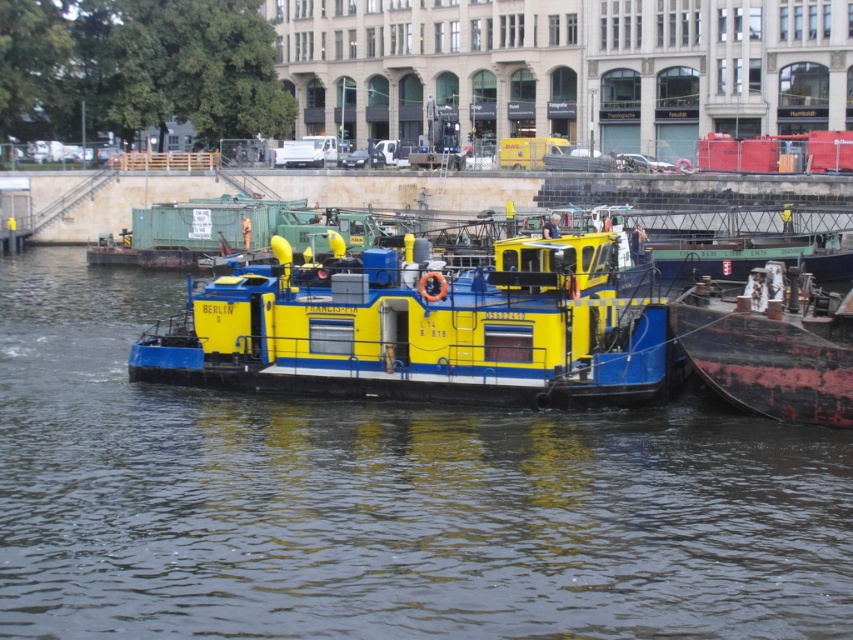
You are a crane operator standing on a platform 2 meters above the water level. You need to lower a heavy load onto the yellow matte barge at center. Given that the crane cable can extend up to 30 meters, will you be able to safely lower the load onto the barge?

The distance between the yellow matte barge at center and the camera is 26.13 meters. Since the crane cable can extend up to 30 meters, and the platform is only 2 meters above the water, the crane has sufficient reach to lower the load onto the barge safely.

You are a crane operator trying to move a container from the yellow matte barge at center to the rusty metal barge at right. Considering their widths, which barge can accommodate the container more easily?

The yellow matte barge at center might be wider than rusty metal barge at right, so it can accommodate the container more easily due to its potentially larger width.